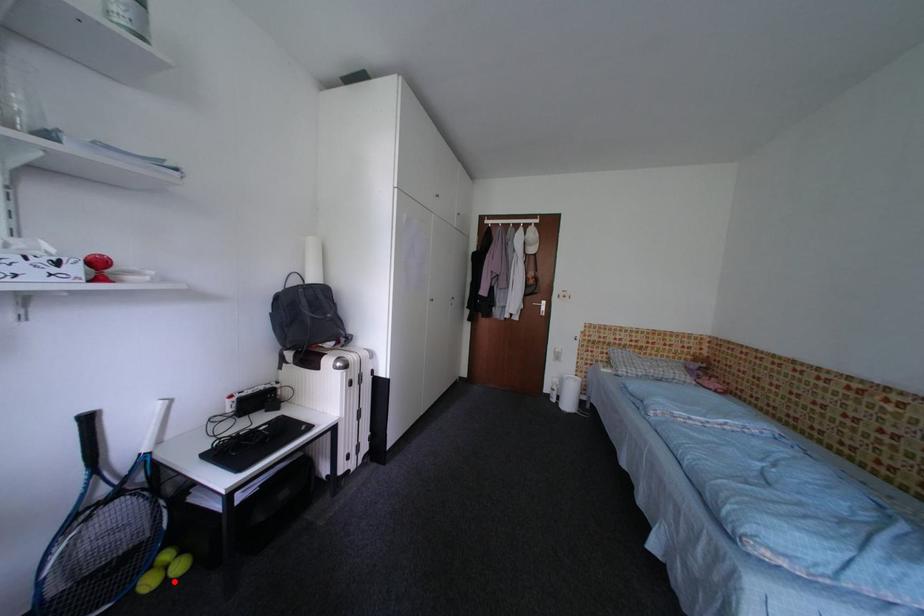
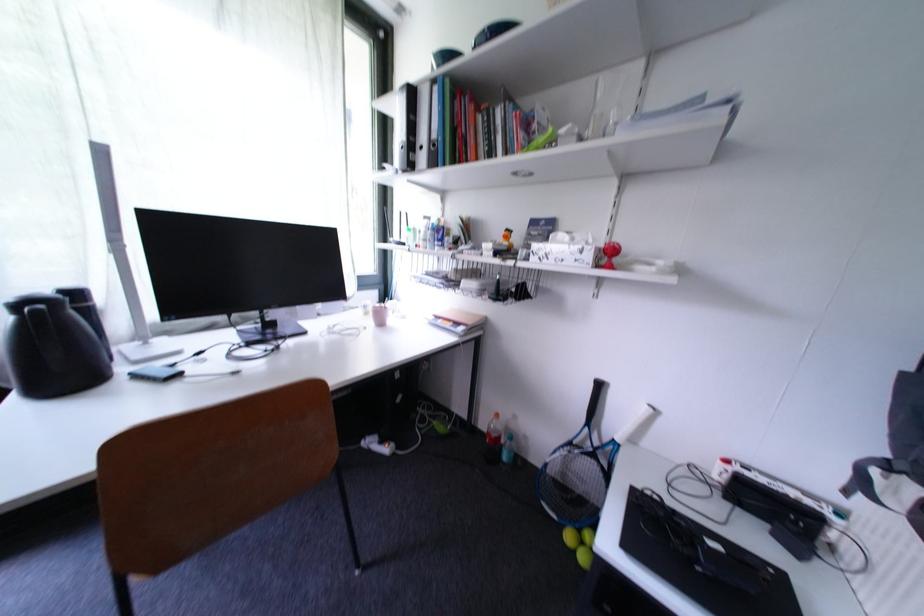
Question: A red point is marked in image1. In image2, is the corresponding 3D point closer to the camera or farther? Reply with the corresponding letter.

Choices:
 (A) The corresponding 3D point is closer.
 (B) The corresponding 3D point is farther.

Answer: (B)